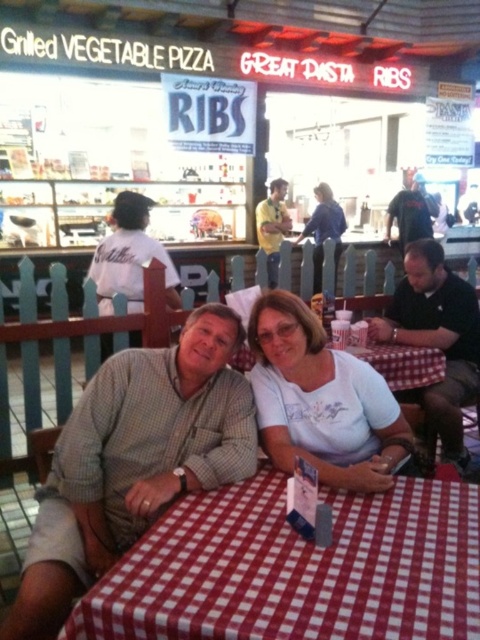
Does black shirt at right have a lesser height compared to blue denim shirt at center?

Indeed, black shirt at right has a lesser height compared to blue denim shirt at center.

Locate an element on the screen. This screenshot has width=480, height=640. black shirt at right is located at coordinates (437, 337).

Between point (430, 307) and point (326, 224), which one is positioned behind?

Point (326, 224)

This screenshot has width=480, height=640. Find the location of `black shirt at right`. black shirt at right is located at coordinates (437, 337).

Consider the image. Is red checkered tablecloth at center above yellow shirt at center?

Actually, red checkered tablecloth at center is below yellow shirt at center.

Does red checkered tablecloth at center have a larger size compared to yellow shirt at center?

Incorrect, red checkered tablecloth at center is not larger than yellow shirt at center.

Identify the location of red checkered tablecloth at center. The image size is (480, 640). (297, 568).

At what (x,y) coordinates should I click in order to perform the action: click on red checkered tablecloth at center. Please return your answer as a coordinate pair (x, y). Image resolution: width=480 pixels, height=640 pixels. Looking at the image, I should click on (297, 568).

Consider the image. Who is positioned more to the left, checkered shirt at center or white matte shirt at center?

checkered shirt at center

Which of these two, checkered shirt at center or white matte shirt at center, stands shorter?

Standing shorter between the two is white matte shirt at center.

Identify the location of checkered shirt at center. The width and height of the screenshot is (480, 640). (133, 460).

You are a GUI agent. You are given a task and a screenshot of the screen. Output one action in this format:
    pyautogui.click(x=<x>, y=<y>)
    Task: Click on the checkered shirt at center
    Image resolution: width=480 pixels, height=640 pixels.
    Given the screenshot: What is the action you would take?
    pyautogui.click(x=133, y=460)